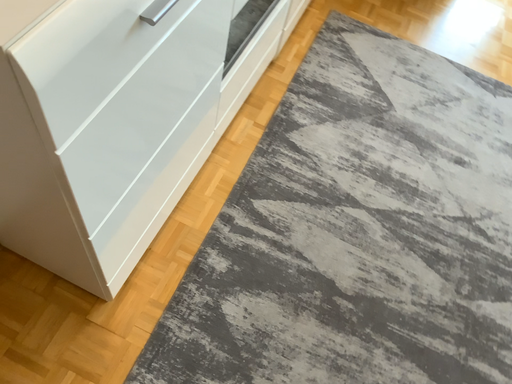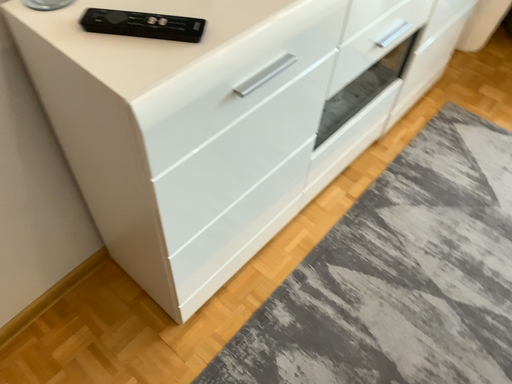
Question: How did the camera likely rotate when shooting the video?

Choices:
 (A) rotated right
 (B) rotated left

Answer: (B)